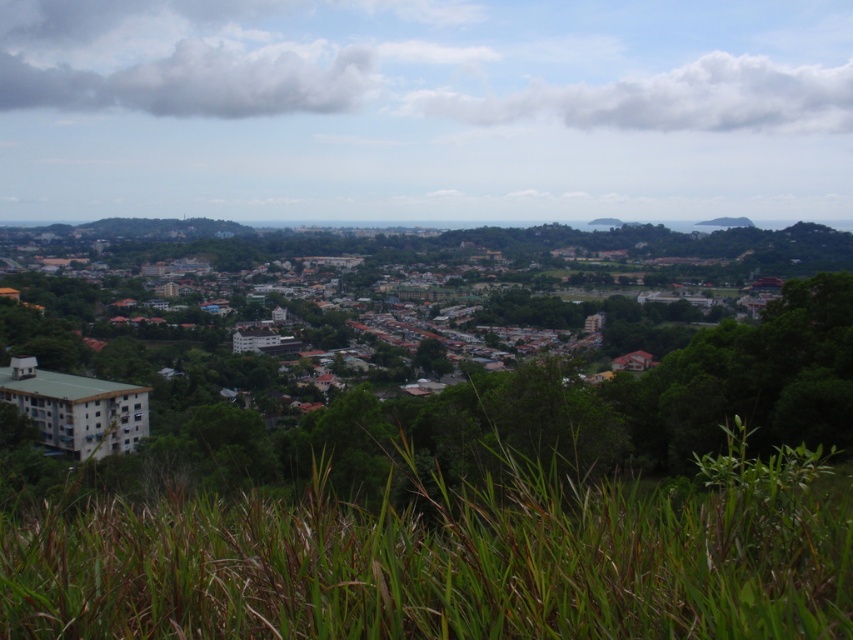
The width and height of the screenshot is (853, 640). What do you see at coordinates (422, 348) in the screenshot?
I see `white matte building at left` at bounding box center [422, 348].

Does white matte building at left have a lesser width compared to green grass at lower center?

No, white matte building at left is not thinner than green grass at lower center.

Locate an element on the screen. This screenshot has height=640, width=853. white matte building at left is located at coordinates (422, 348).